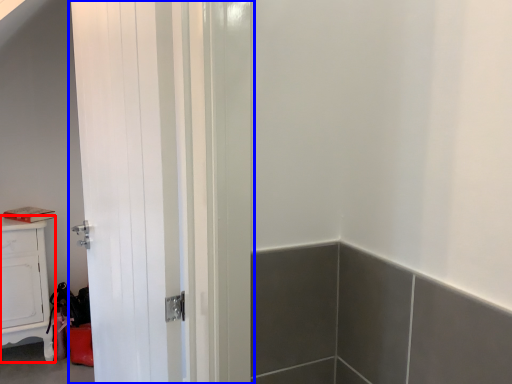
Question: Which point is closer to the camera, cabinetry (highlighted by a red box) or door (highlighted by a blue box)?

Choices:
 (A) cabinetry
 (B) door

Answer: (B)